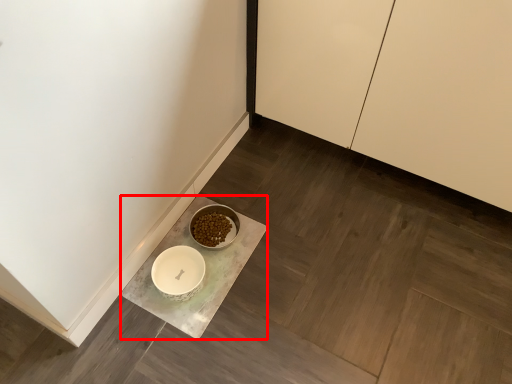
Question: Observing the image, what is the correct spatial positioning of counter (annotated by the red box) in reference to cabinetry?

Choices:
 (A) right
 (B) left

Answer: (B)